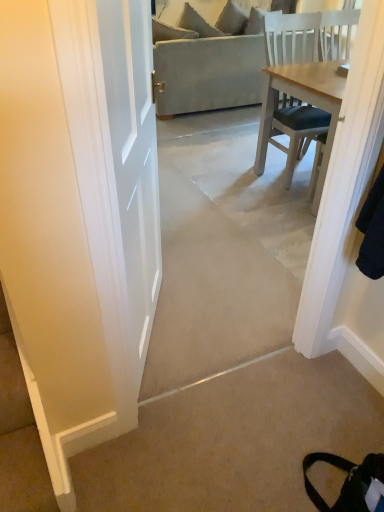
Question: Do you think beige carpet at lower right is within beige fabric couch at center, or outside of it?

Choices:
 (A) outside
 (B) inside

Answer: (A)

Question: Considering the positions of point (380, 446) and point (155, 27), is point (380, 446) closer or farther from the camera than point (155, 27)?

Choices:
 (A) farther
 (B) closer

Answer: (B)

Question: In the image, is beige carpet at lower right positioned in front of or behind beige fabric couch at center?

Choices:
 (A) front
 (B) behind

Answer: (A)

Question: From a real-world perspective, relative to beige carpet at lower right, is beige fabric couch at center vertically above or below?

Choices:
 (A) above
 (B) below

Answer: (A)

Question: Considering their positions, is beige fabric couch at center located in front of or behind beige carpet at lower right?

Choices:
 (A) front
 (B) behind

Answer: (B)

Question: Considering the relative positions of beige fabric couch at center and beige carpet at lower right in the image provided, is beige fabric couch at center to the left or to the right of beige carpet at lower right?

Choices:
 (A) right
 (B) left

Answer: (A)

Question: Is beige fabric couch at center spatially inside beige carpet at lower right, or outside of it?

Choices:
 (A) inside
 (B) outside

Answer: (B)